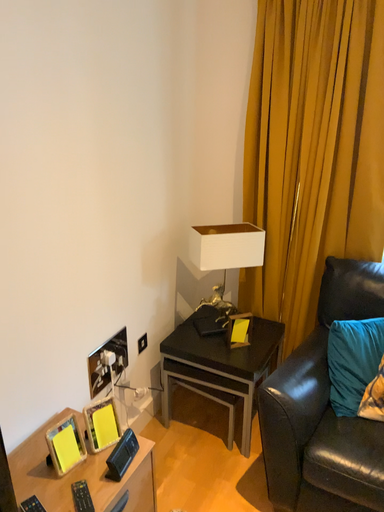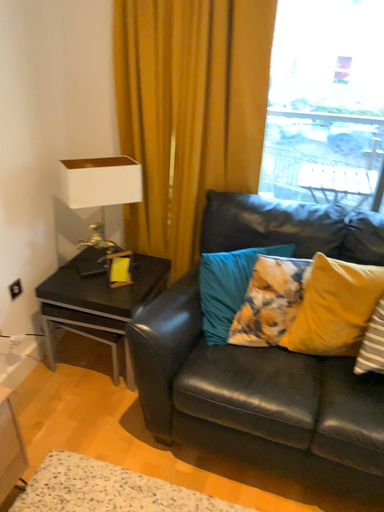
Question: Which way did the camera rotate in the video?

Choices:
 (A) rotated upward
 (B) rotated downward

Answer: (B)